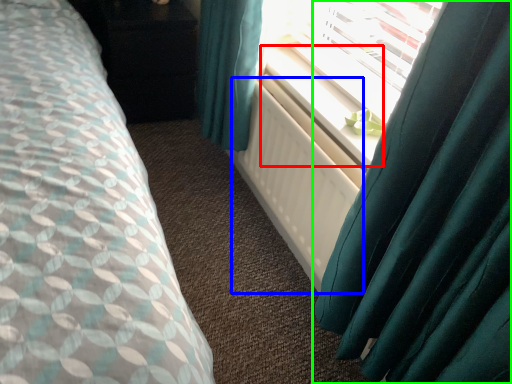
Question: Which object is positioned farthest from window sill (highlighted by a red box)? Select from radiator (highlighted by a blue box) and curtain (highlighted by a green box).

Choices:
 (A) radiator
 (B) curtain

Answer: (B)